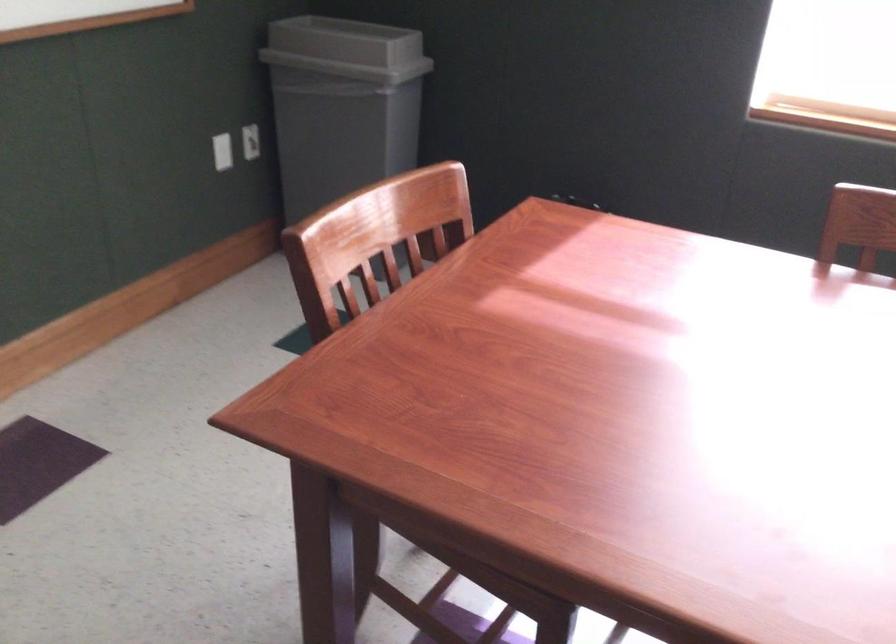
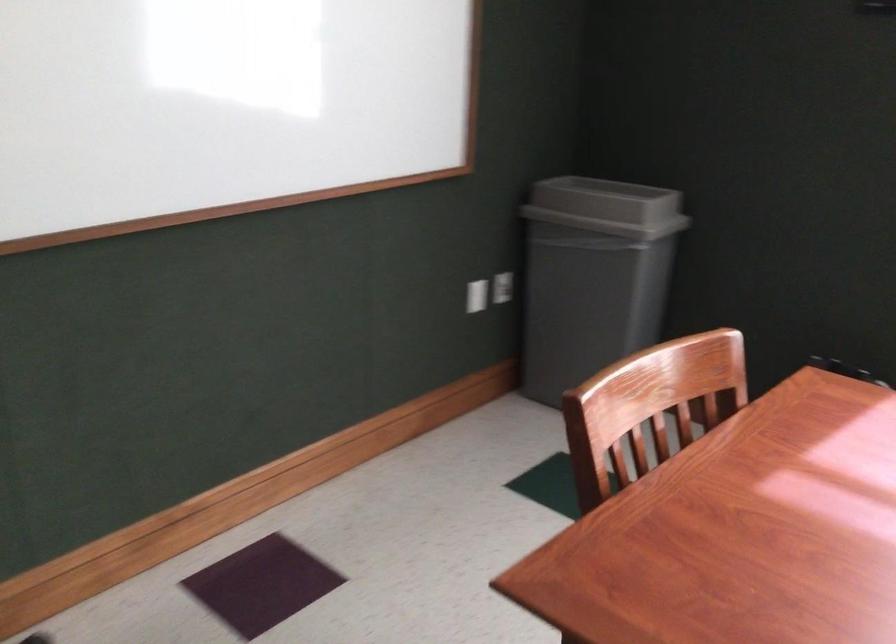
Find the pixel in the second image that matches the point at 255,142 in the first image.

(503, 287)